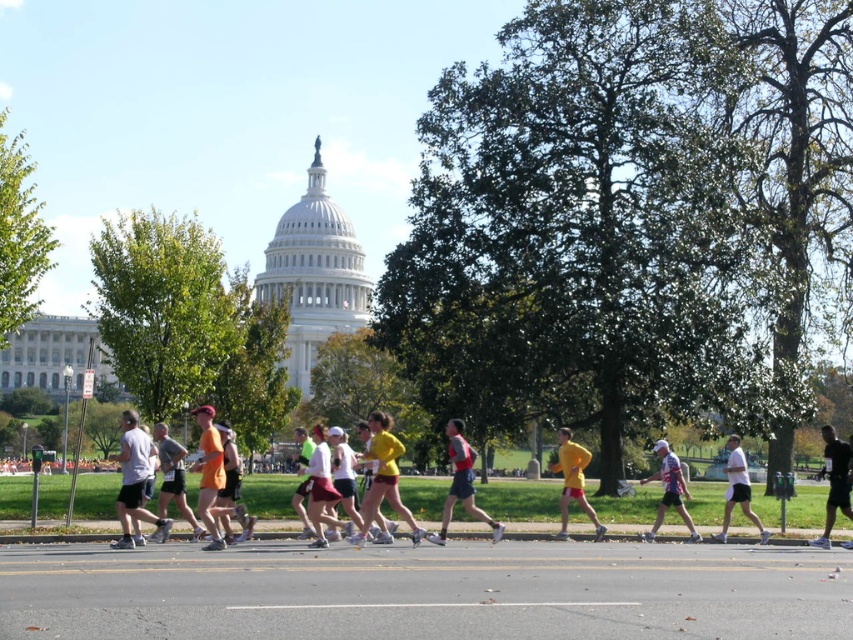
You are a photographer at the marathon and want to capture a runner wearing both the orange fabric shirt at center and white matte shorts at center. Which part of the runner should you focus on to ensure both items are visible in the frame?

The orange fabric shirt at center is much taller than the white matte shorts at center, so focusing on the upper body area where the orange fabric shirt at center is located will ensure both items are visible in the frame.

You are a photographer at the marathon and want to capture both the matte gray shirt at center and the white matte jersey at center in a single shot. Based on their positions, which one is lower in the frame?

The matte gray shirt at center is below the white matte jersey at center, so it is lower in the frame.